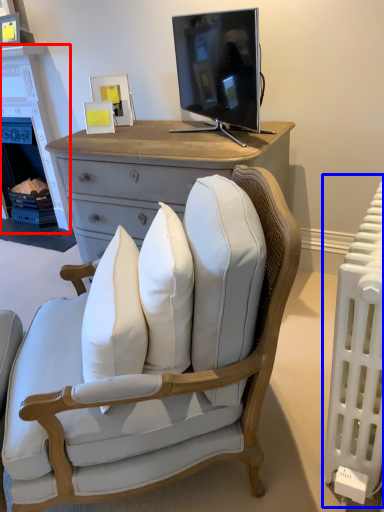
Question: Which of the following is the closest to the observer, fireplace (highlighted by a red box) or radiator (highlighted by a blue box)?

Choices:
 (A) fireplace
 (B) radiator

Answer: (B)